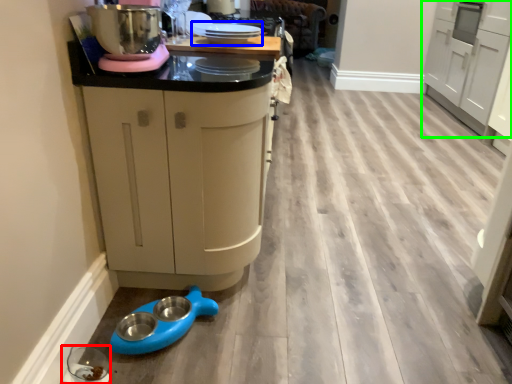
Question: Considering the real-world distances, which object is closest to appliance (highlighted by a red box)? appliance (highlighted by a blue box) or cabinetry (highlighted by a green box).

Choices:
 (A) appliance
 (B) cabinetry

Answer: (A)